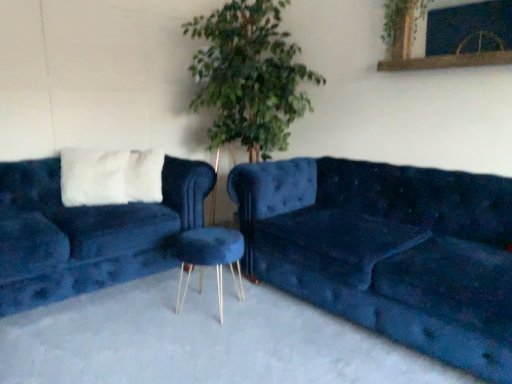
Question: From a real-world perspective, is velvet blue couch at left, arranged as the 1th studio couch when viewed from the left, on velvet blue stool at center?

Choices:
 (A) yes
 (B) no

Answer: (A)

Question: From the image's perspective, is velvet blue couch at left, acting as the second studio couch starting from the right, beneath velvet blue stool at center?

Choices:
 (A) yes
 (B) no

Answer: (B)

Question: Considering the relative positions of velvet blue couch at left, arranged as the 1th studio couch when viewed from the left, and velvet blue stool at center in the image provided, is velvet blue couch at left, arranged as the 1th studio couch when viewed from the left, to the right of velvet blue stool at center from the viewer's perspective?

Choices:
 (A) yes
 (B) no

Answer: (B)

Question: Is velvet blue couch at left, arranged as the 1th studio couch when viewed from the left, looking in the opposite direction of velvet blue stool at center?

Choices:
 (A) no
 (B) yes

Answer: (A)

Question: Is velvet blue stool at center inside velvet blue couch at left, acting as the second studio couch starting from the right?

Choices:
 (A) yes
 (B) no

Answer: (B)

Question: From the image's perspective, is green leafy plant at upper center located above or below velvet blue couch at right, which appears as the first studio couch when viewed from the right?

Choices:
 (A) above
 (B) below

Answer: (A)

Question: Based on their sizes in the image, would you say green leafy plant at upper center is bigger or smaller than velvet blue couch at right, which appears as the first studio couch when viewed from the right?

Choices:
 (A) small
 (B) big

Answer: (A)

Question: From a real-world perspective, relative to velvet blue couch at right, which appears as the first studio couch when viewed from the right, is green leafy plant at upper center vertically above or below?

Choices:
 (A) below
 (B) above

Answer: (B)

Question: In the image, is green leafy plant at upper center positioned in front of or behind velvet blue couch at right, which is counted as the second studio couch, starting from the left?

Choices:
 (A) behind
 (B) front

Answer: (A)

Question: From a real-world perspective, relative to velvet blue couch at right, which appears as the first studio couch when viewed from the right, is velvet blue couch at left, arranged as the 1th studio couch when viewed from the left, vertically above or below?

Choices:
 (A) above
 (B) below

Answer: (A)

Question: Is velvet blue couch at left, arranged as the 1th studio couch when viewed from the left, situated inside velvet blue couch at right, which appears as the first studio couch when viewed from the right, or outside?

Choices:
 (A) outside
 (B) inside

Answer: (A)

Question: Is point (76, 256) positioned closer to the camera than point (421, 208)?

Choices:
 (A) farther
 (B) closer

Answer: (B)

Question: Based on their sizes in the image, would you say velvet blue couch at left, acting as the second studio couch starting from the right, is bigger or smaller than velvet blue couch at right, which is counted as the second studio couch, starting from the left?

Choices:
 (A) big
 (B) small

Answer: (B)

Question: Considering their positions, is velvet blue couch at right, which is counted as the second studio couch, starting from the left, located in front of or behind velvet blue couch at left, arranged as the 1th studio couch when viewed from the left?

Choices:
 (A) front
 (B) behind

Answer: (A)

Question: In terms of width, does velvet blue couch at right, which appears as the first studio couch when viewed from the right, look wider or thinner when compared to velvet blue couch at left, arranged as the 1th studio couch when viewed from the left?

Choices:
 (A) wide
 (B) thin

Answer: (A)